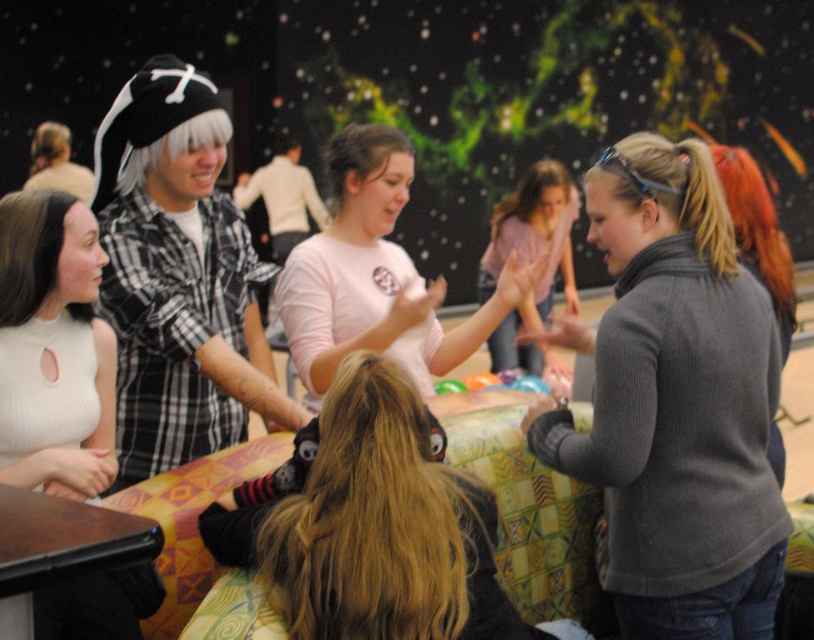
Question: Based on their relative distances, which object is nearer to the blonde hair at center?

Choices:
 (A) matte pink shirt at center
 (B) matte black pirate hat at upper left
 (C) white matte shirt at left
 (D) gray sweater at right

Answer: (D)

Question: Is blonde hair at center wider than matte black pirate hat at upper left?

Choices:
 (A) yes
 (B) no

Answer: (B)

Question: Which point appears farthest from the camera in this image?

Choices:
 (A) (303, 564)
 (B) (373, 292)

Answer: (B)

Question: Which of these objects is positioned farthest from the matte black pirate hat at upper left?

Choices:
 (A) white matte shirt at left
 (B) gray sweater at right
 (C) pink matte shirt at center

Answer: (B)

Question: From the image, what is the correct spatial relationship of blonde hair at center in relation to matte black pirate hat at upper left?

Choices:
 (A) left
 (B) right

Answer: (B)

Question: From the image, what is the correct spatial relationship of gray sweater at right in relation to matte black pirate hat at upper left?

Choices:
 (A) below
 (B) above

Answer: (A)